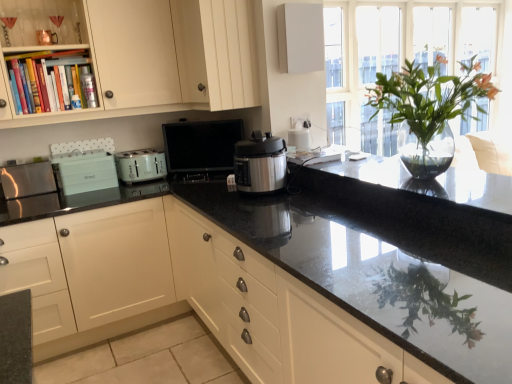
At what (x,y) coordinates should I click in order to perform the action: click on free space above matte green toaster at center (from a real-world perspective). Please return your answer as a coordinate pair (x, y). The image size is (512, 384). Looking at the image, I should click on (139, 153).